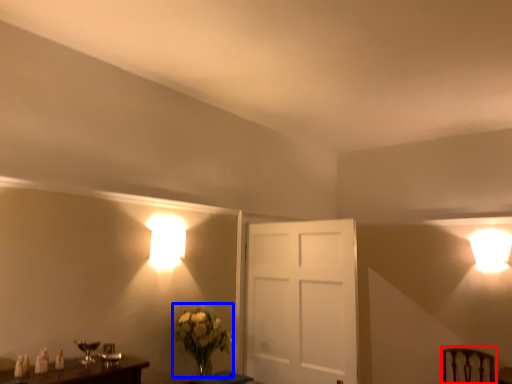
Question: Which object is closer to the camera taking this photo, swivel chair (highlighted by a red box) or floral arrangement (highlighted by a blue box)?

Choices:
 (A) swivel chair
 (B) floral arrangement

Answer: (B)